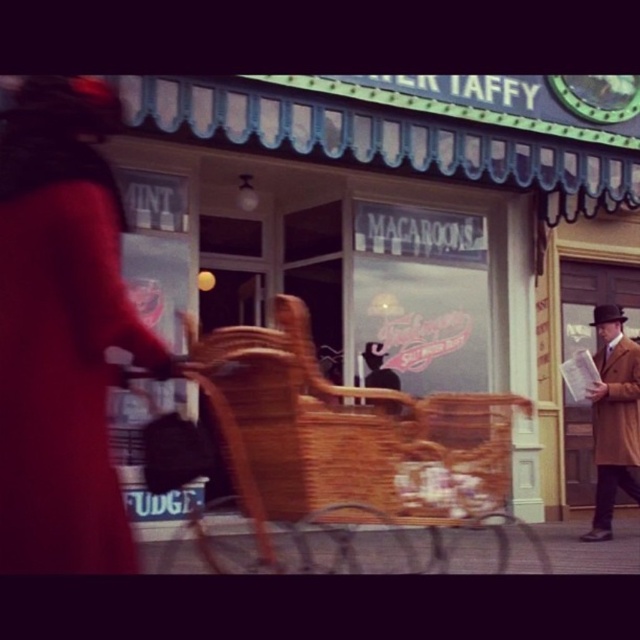
Question: Is velvet red coat at upper left closer to camera compared to brown wool coat at right?

Choices:
 (A) no
 (B) yes

Answer: (B)

Question: Can you confirm if brown wool coat at right is wider than tan wool coat at right?

Choices:
 (A) yes
 (B) no

Answer: (A)

Question: Which point is farther from the camera taking this photo?

Choices:
 (A) (93, 252)
 (B) (618, 440)

Answer: (B)

Question: Which is nearer to the velvet red coat at upper left?

Choices:
 (A) tan wool coat at right
 (B) brown wool coat at right

Answer: (A)

Question: From the image, what is the correct spatial relationship of woven wood baby carriage at center in relation to brown wool coat at right?

Choices:
 (A) below
 (B) above

Answer: (A)

Question: Among these points, which one is farthest from the camera?

Choices:
 (A) (40, 195)
 (B) (605, 324)
 (C) (611, 435)

Answer: (B)